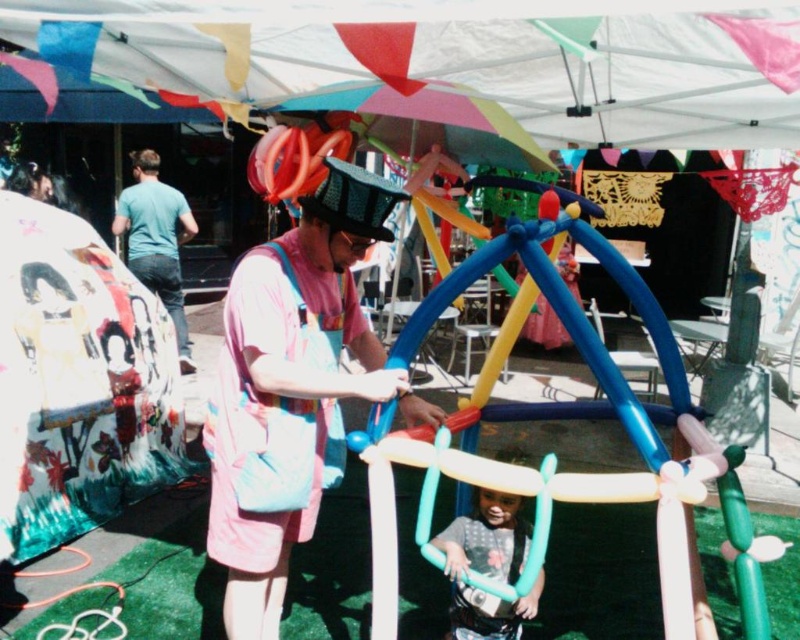
You are a visitor at the fair and want to take a photo of the multicolored balloon structure at center without any obstructions. The pink fabric bag at center might be in the way. Is the bag blocking the view of the balloon structure?

The pink fabric bag at center is located below the multicolored balloon structure at center, so it is not blocking the view of the balloon structure.

You are at the center of the scene and want to give a gift to the multicolored balloon structure at center. In which direction should you move to reach it?

The multicolored balloon structure at center is located at point (564, 419), so you should move towards the lower right direction to reach it.